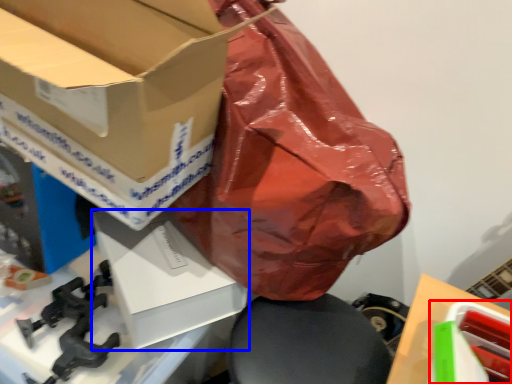
Question: Which object is further to the camera taking this photo, box (highlighted by a red box) or box (highlighted by a blue box)?

Choices:
 (A) box
 (B) box

Answer: (B)